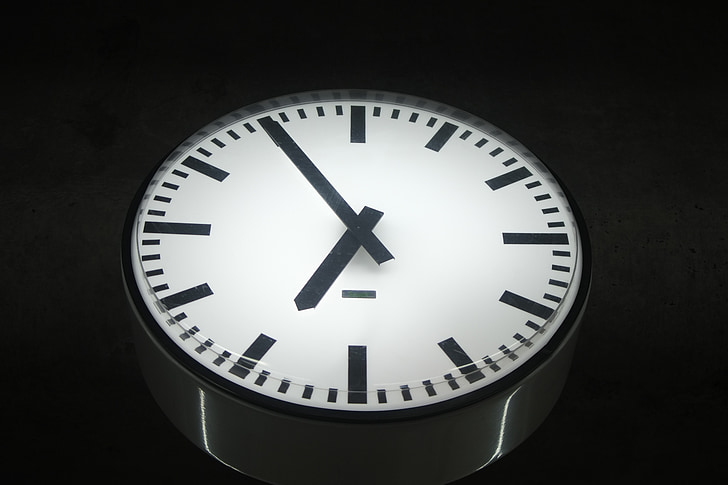
This screenshot has width=728, height=485. What are the coordinates of `clock bottom` in the screenshot? It's located at (378, 459), (153, 385), (537, 400).